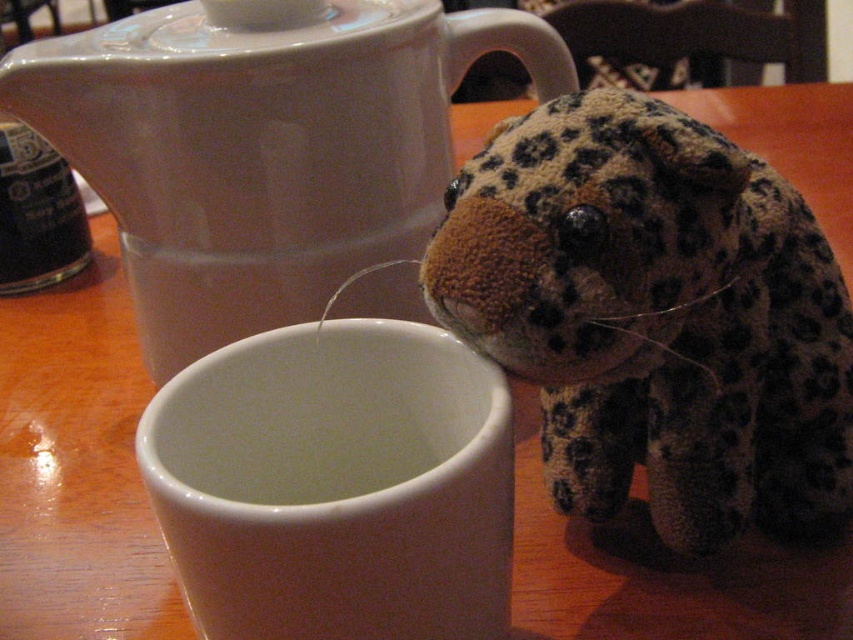
Question: Does white matte cup at center have a larger size compared to black matte bottle at left?

Choices:
 (A) yes
 (B) no

Answer: (A)

Question: Can you confirm if fuzzy leopard plush at right is thinner than white glossy teapot at upper center?

Choices:
 (A) yes
 (B) no

Answer: (A)

Question: Among these objects, which one is farthest from the camera?

Choices:
 (A) white glossy mug at center
 (B) white glossy teapot at upper center
 (C) white matte cup at center

Answer: (B)

Question: Is fuzzy leopard plush at right below white matte cup at center?

Choices:
 (A) no
 (B) yes

Answer: (A)

Question: Which point is closer to the camera taking this photo?

Choices:
 (A) (294, 484)
 (B) (699, 173)
 (C) (471, 515)
 (D) (42, 200)

Answer: (C)

Question: Which point is farther from the camera taking this photo?

Choices:
 (A) (432, 448)
 (B) (383, 579)

Answer: (A)